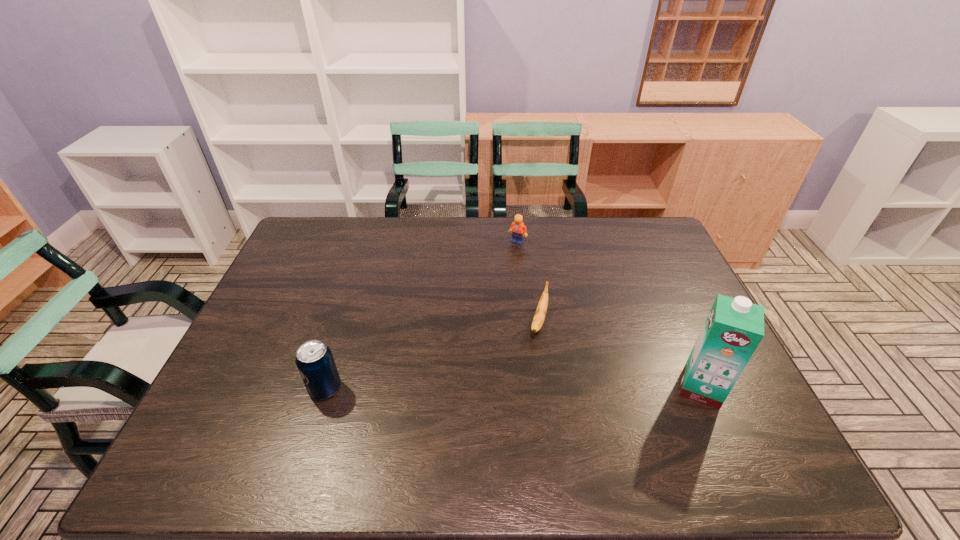
Find the location of a particular element. The width and height of the screenshot is (960, 540). free location that satisfies the following two spatial constraints: 1. on the back side of the Lego; 2. on the right side of the third shortest object is located at coordinates (371, 242).